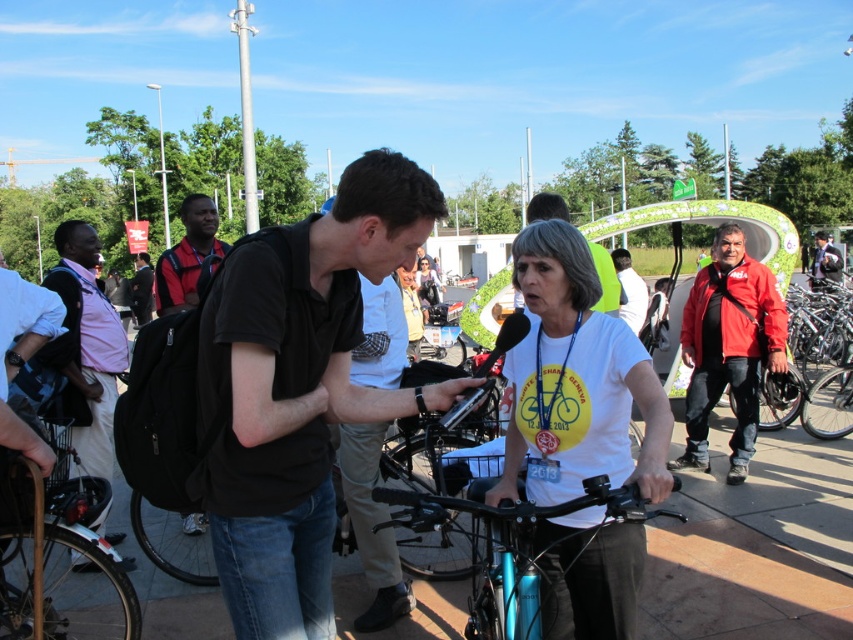
You are standing in the scene and want to take a photo of both point (384, 349) and point (816, 256). Which point should you focus on first to ensure both are in focus?

You should focus on point (384, 349) first because it is closer to the camera than point (816, 256). This way, the depth of field will likely include both points when focused on the closer one.

You are a photographer at the event and want to capture a photo that includes both the pink shirt at left and the matte black shirt at center. Based on their positions, which shirt should you focus on first to ensure both are in the frame?

The pink shirt at left is below the matte black shirt at center, so you should focus on the matte black shirt at center first to ensure both are in the frame.